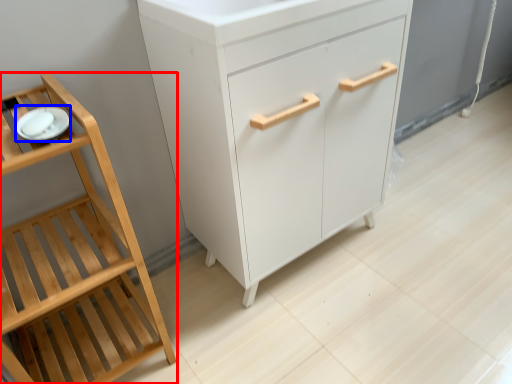
Question: Which object is further to the camera taking this photo, furniture (highlighted by a red box) or tableware (highlighted by a blue box)?

Choices:
 (A) furniture
 (B) tableware

Answer: (B)